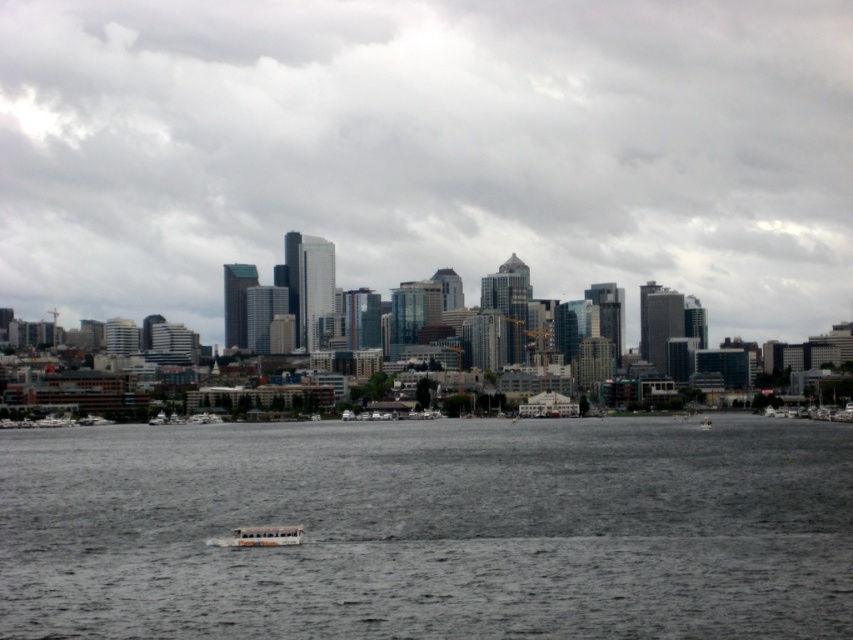
Can you confirm if gray water at center is wider than white plastic boat at lower center?

Correct, the width of gray water at center exceeds that of white plastic boat at lower center.

Based on the photo, is gray water at center to the right of white plastic boat at lower center from the viewer's perspective?

Correct, you'll find gray water at center to the right of white plastic boat at lower center.

Locate an element on the screen. This screenshot has width=853, height=640. gray water at center is located at coordinates (430, 529).

You are a GUI agent. You are given a task and a screenshot of the screen. Output one action in this format:
    pyautogui.click(x=<x>, y=<y>)
    Task: Click on the gray water at center
    The height and width of the screenshot is (640, 853).
    Given the screenshot: What is the action you would take?
    pyautogui.click(x=430, y=529)

Does transparent glass skyscrapers at center have a smaller size compared to gray water at center?

Incorrect, transparent glass skyscrapers at center is not smaller in size than gray water at center.

Between point (426, 236) and point (91, 596), which one is positioned in front?

Positioned in front is point (426, 236).

Find the location of a particular element. transparent glass skyscrapers at center is located at coordinates (428, 150).

Based on the photo, does gray water at center have a lesser height compared to white plastic boat at center?

Incorrect, gray water at center's height does not fall short of white plastic boat at center's.

Does gray water at center appear on the right side of white plastic boat at center?

Incorrect, gray water at center is not on the right side of white plastic boat at center.

Which is behind, point (222, 612) or point (698, 426)?

The point (698, 426) is behind.

This screenshot has height=640, width=853. I want to click on gray water at center, so click(430, 529).